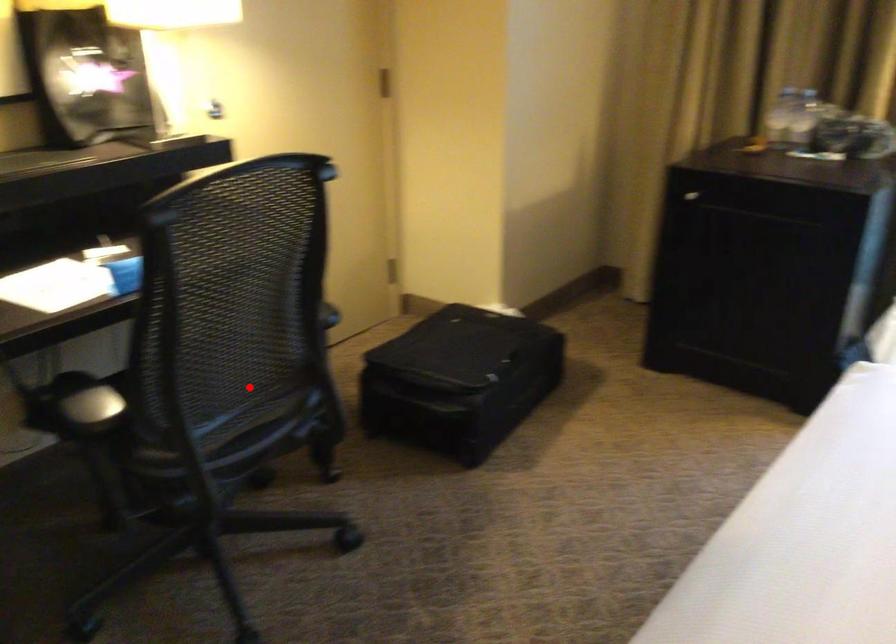
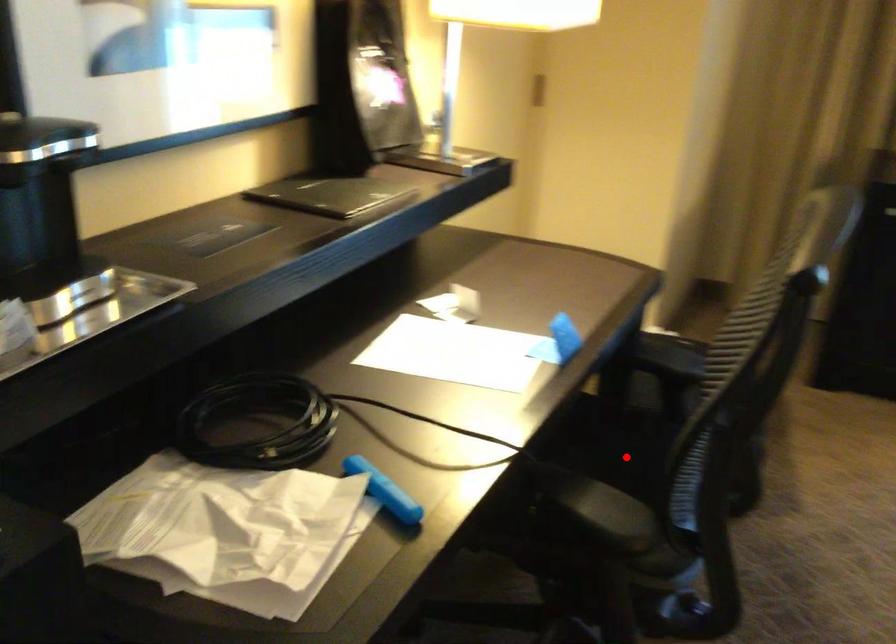
I am providing you with two images of the same scene from different viewpoints. A red point is marked on the first image and another point is marked on the second image. Does the point marked in image1 correspond to the same location as the one in image2?

Yes